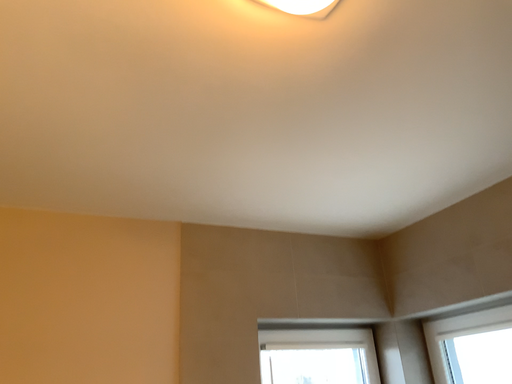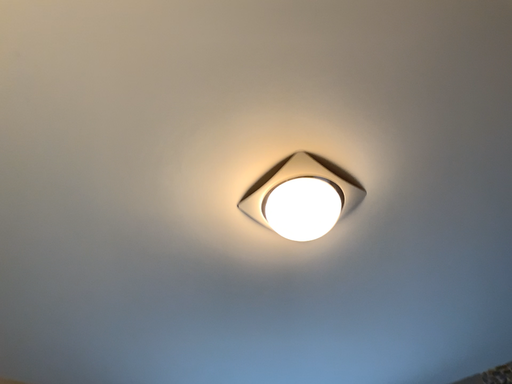
Question: Which way did the camera rotate in the video?

Choices:
 (A) rotated right
 (B) rotated left

Answer: (A)